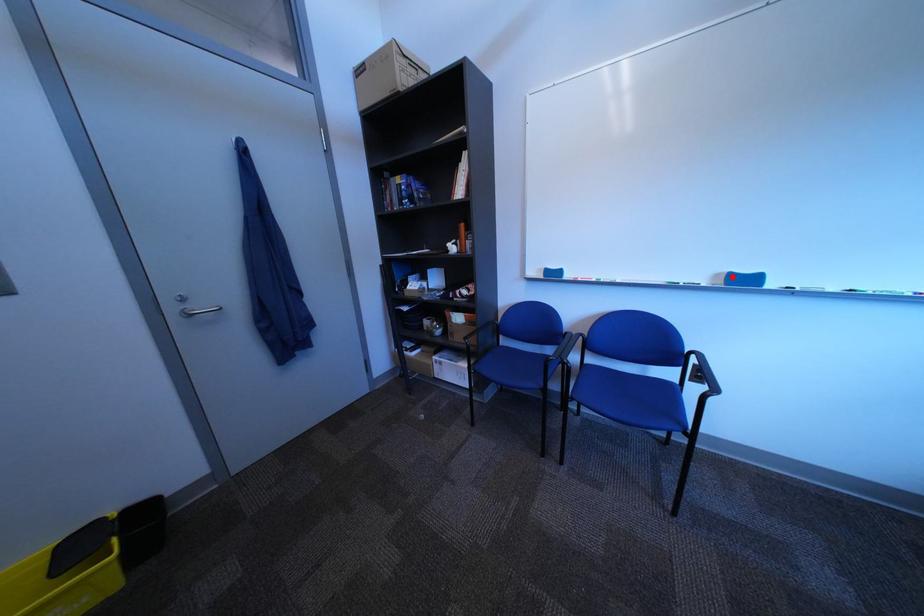
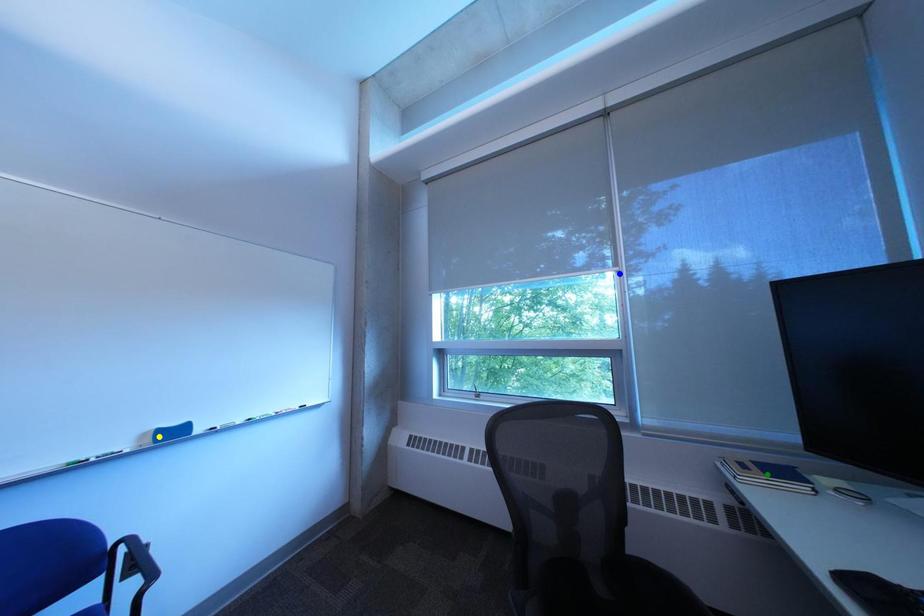
Question: I am providing you with two images of the same scene from different viewpoints. A red point is marked on the first image. You are given multiple points on the second image. In image 2, which mark is for the same physical point as the one in image 1?

Choices:
 (A) green point
 (B) yellow point
 (C) blue point

Answer: (B)